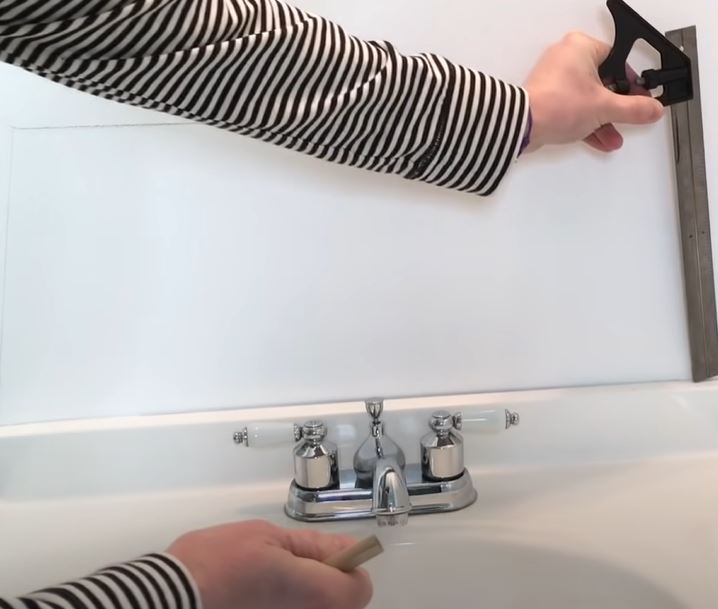
Identify the location of knob. (370, 406).